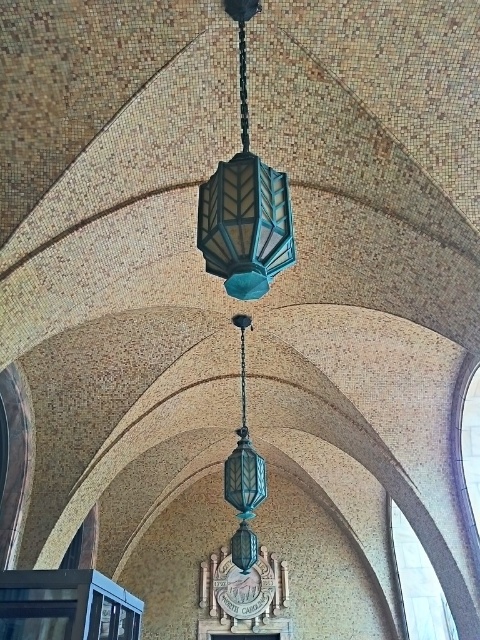
You are an interior designer planning to hang a new artwork exactly between the teal glass lantern at center and the teal glass pendant light at center. Since both are hanging at the same horizontal position, which one should you place the artwork above or below to ensure it is centered between them?

The artwork should be placed below the teal glass pendant light at center and above the teal glass lantern at center since the teal glass lantern at center is shorter in height than the teal glass pendant light at center.

You are an interior designer planning to install a new fixture that requires a minimum width of 30 cm. You observe the teal glass lantern at center and the teal glass pendant light at center. Which one meets the width requirement?

The teal glass pendant light at center meets the width requirement since it is wider than the teal glass lantern at center, and assuming the lantern is below 30 cm, the pendant light likely exceeds it.